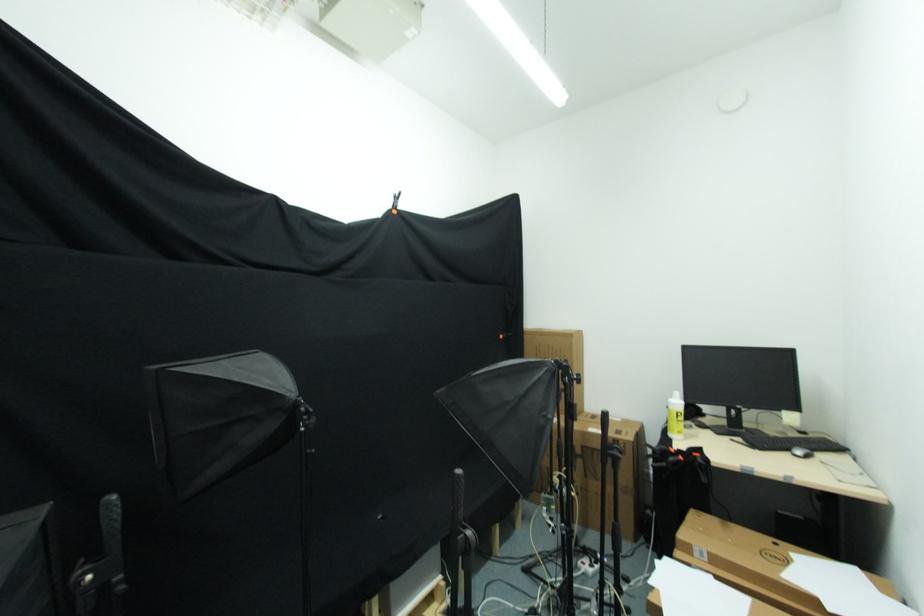
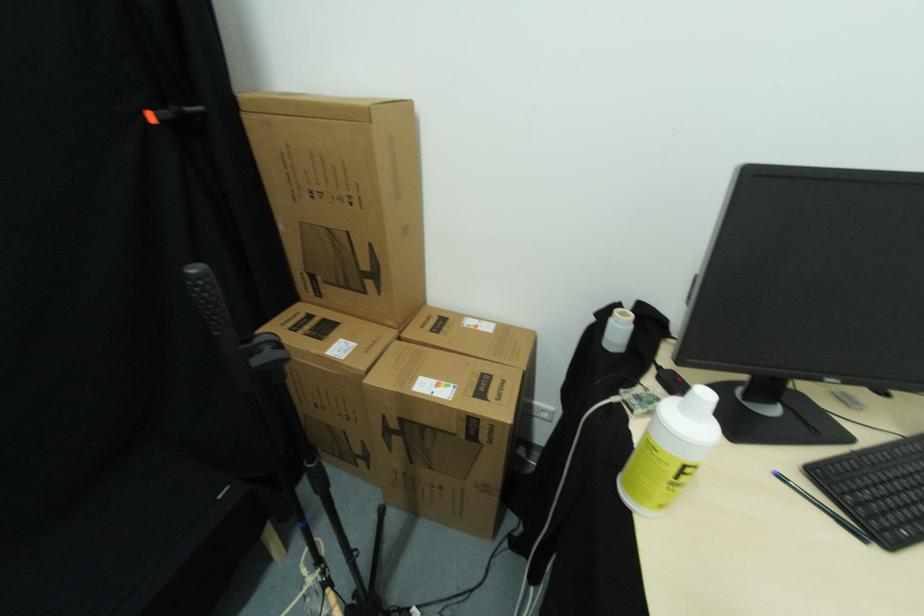
The point at (679, 421) is marked in the first image. Where is the corresponding point in the second image?

(678, 480)